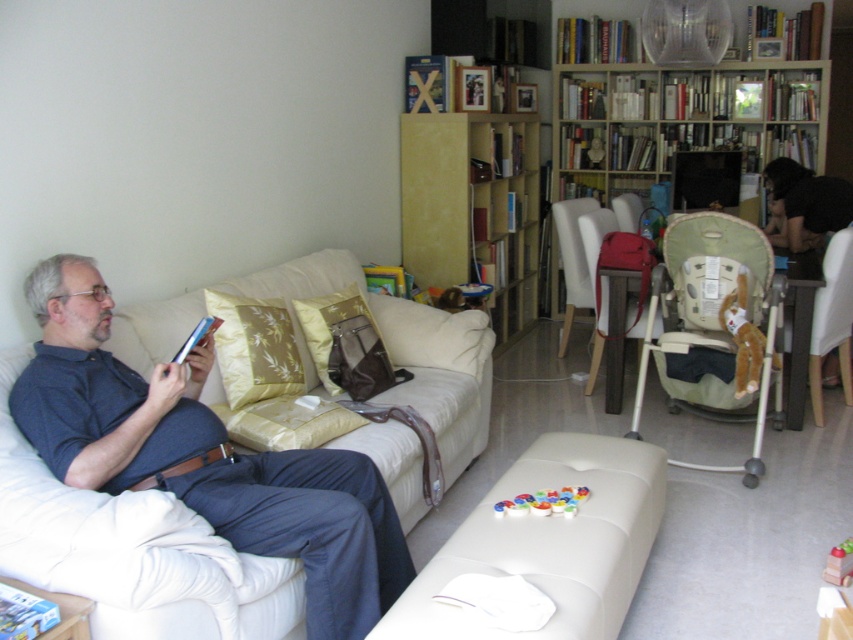
Question: Can you confirm if wooden bookshelf at upper center is bigger than yellow matte bookshelf at center?

Choices:
 (A) yes
 (B) no

Answer: (B)

Question: Is beige fabric couch at left below blue denim pants at lower left?

Choices:
 (A) yes
 (B) no

Answer: (B)

Question: Observing the image, what is the correct spatial positioning of gold textured pillow at center in reference to multicolored plastic rings at center?

Choices:
 (A) left
 (B) right

Answer: (A)

Question: Which point appears closest to the camera in this image?

Choices:
 (A) tap(370, 332)
 (B) tap(460, 179)
 (C) tap(141, 483)

Answer: (C)

Question: Which object appears closest to the camera in this image?

Choices:
 (A) beige fabric baby carriage at right
 (B) beige fabric couch at left

Answer: (B)

Question: Which of the following is the closest to the observer?

Choices:
 (A) matte brown chair at center
 (B) blue denim pants at lower left

Answer: (B)